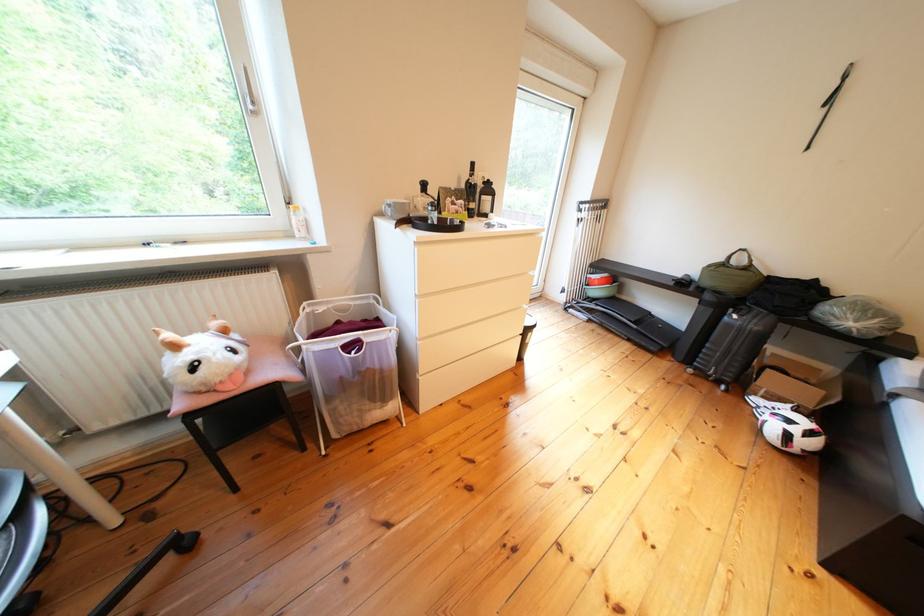
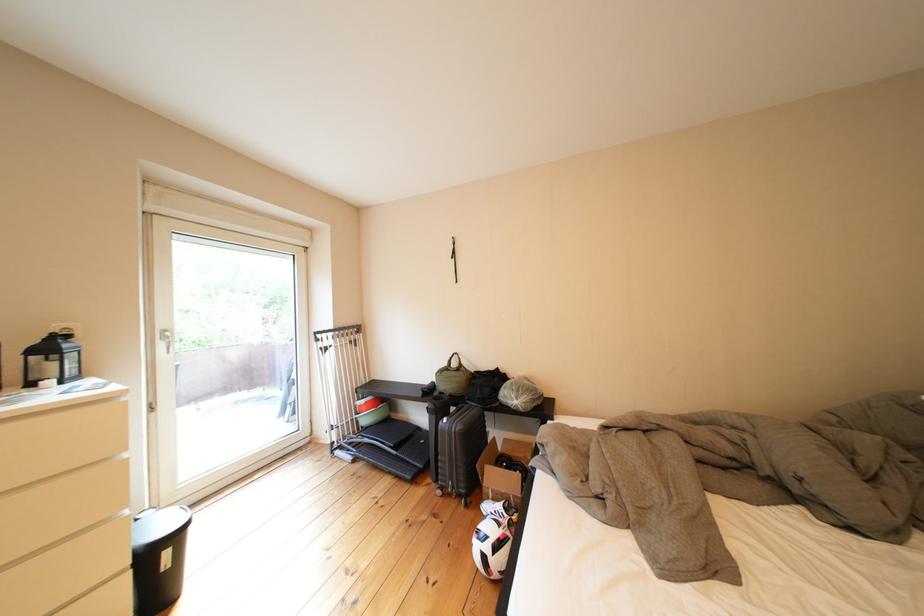
In the second image, find the point that corresponds to (786,386) in the first image.

(505, 480)